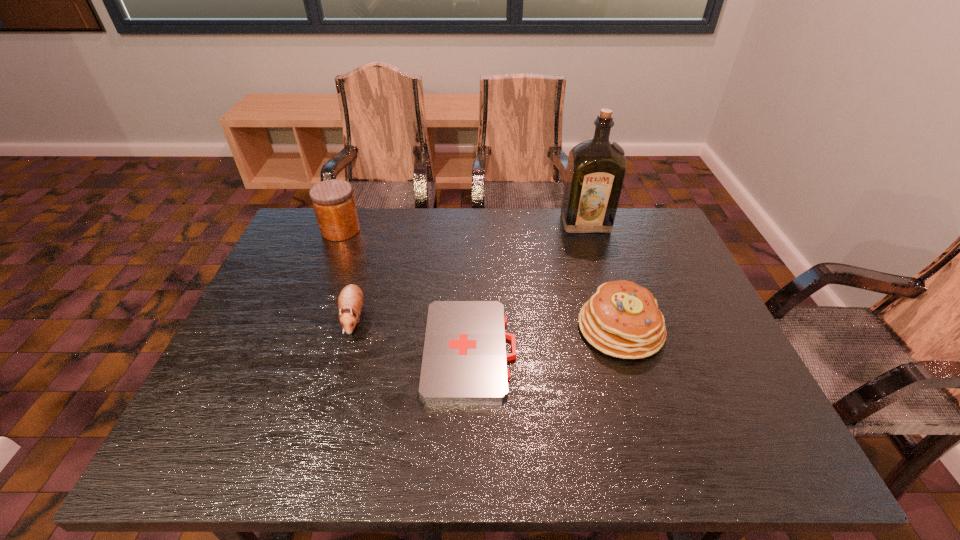
Locate an element on the screen. The height and width of the screenshot is (540, 960). empty location between the jar and the first-aid kit is located at coordinates (405, 289).

Find the location of a particular element. The image size is (960, 540). free space between the third object from left to right and the hamster is located at coordinates (412, 333).

Where is `free space between the hamster and the third object from right to left`? Image resolution: width=960 pixels, height=540 pixels. free space between the hamster and the third object from right to left is located at coordinates (412, 333).

This screenshot has height=540, width=960. I want to click on free space between the fourth tallest object and the jar, so 348,274.

The image size is (960, 540). I want to click on object that is the third nearest to the liquor, so click(350, 301).

Identify which object is the third closest to the tallest object. Please provide its 2D coordinates. Your answer should be formatted as a tuple, i.e. [(x, y)], where the tuple contains the x and y coordinates of a point satisfying the conditions above.

[(350, 301)]

You are a GUI agent. You are given a task and a screenshot of the screen. Output one action in this format:
    pyautogui.click(x=<x>, y=<y>)
    Task: Click on the vacant area in the image that satisfies the following two spatial constraints: 1. on the front side of the pancake; 2. on handle side the shortest object
    The image size is (960, 540).
    Given the screenshot: What is the action you would take?
    pyautogui.click(x=627, y=349)